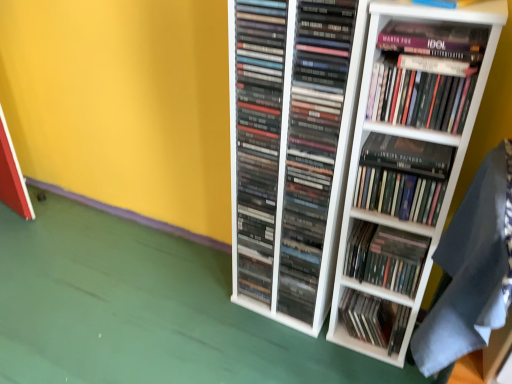
Image resolution: width=512 pixels, height=384 pixels. What are the coordinates of `free space to the left of matte black cds at center, the fifth book from the bottom` in the screenshot? It's located at point(210,286).